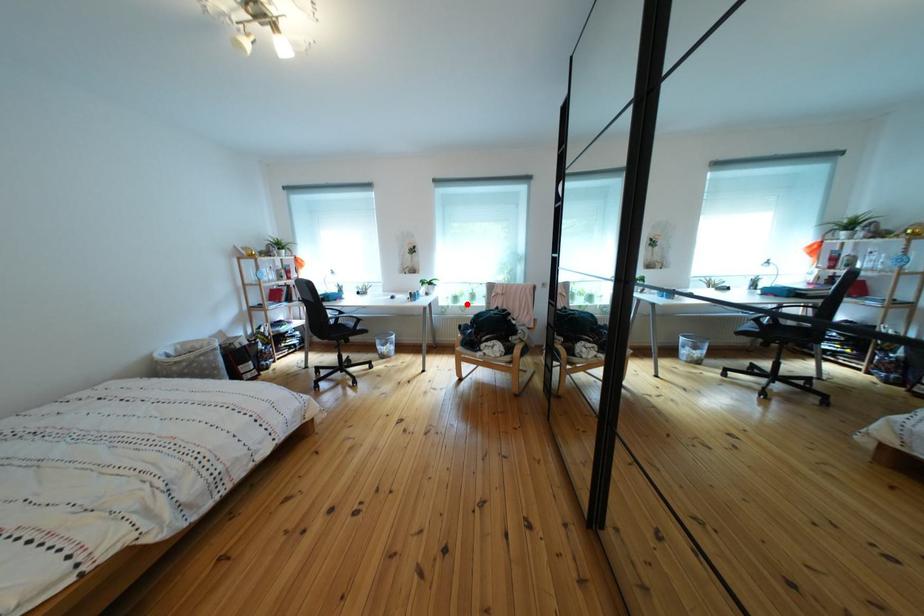
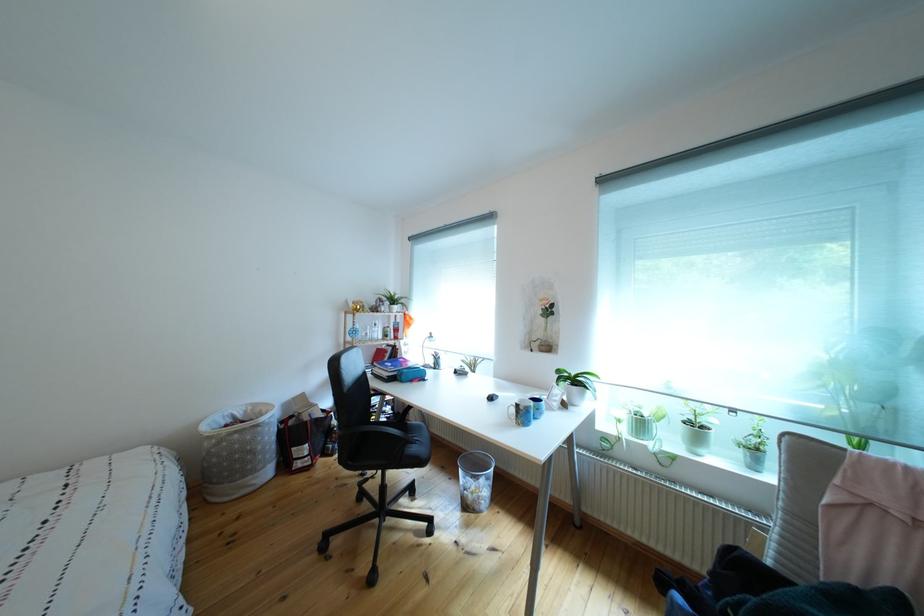
Question: I am providing you with two images of the same scene from different viewpoints. A red point is shown in image1. For the corresponding object point in image2, is it positioned nearer or farther from the camera?

Choices:
 (A) Nearer
 (B) Farther

Answer: (B)